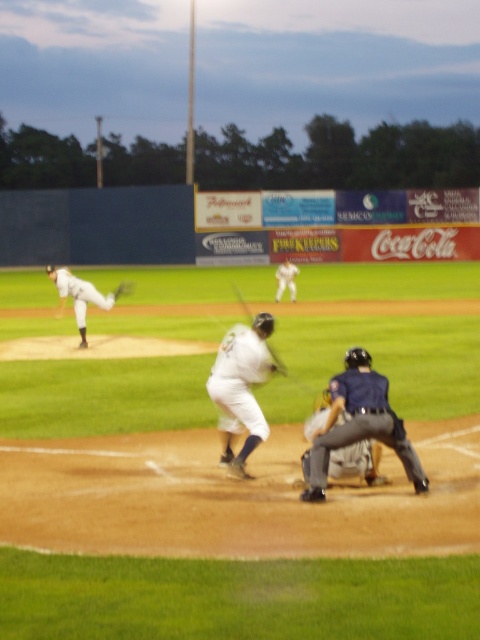
Is gray fabric catcher at center thinner than dark brown leather glove at center?

Indeed, gray fabric catcher at center has a lesser width compared to dark brown leather glove at center.

Is gray fabric catcher at center positioned in front of dark brown leather glove at center?

Yes, gray fabric catcher at center is in front of dark brown leather glove at center.

Is point (310, 454) closer to viewer compared to point (120, 291)?

Yes, it is.

Where is `gray fabric catcher at center`? Image resolution: width=480 pixels, height=640 pixels. gray fabric catcher at center is located at coordinates (357, 461).

Can you confirm if white uniform at center is positioned below wooden baseball bat at center?

No, white uniform at center is not below wooden baseball bat at center.

Does white uniform at center have a greater width compared to wooden baseball bat at center?

No, white uniform at center is not wider than wooden baseball bat at center.

The image size is (480, 640). What are the coordinates of `white uniform at center` in the screenshot? It's located at (286, 280).

Can you confirm if white matte baseball pitcher at left is positioned to the right of white uniform at center?

In fact, white matte baseball pitcher at left is to the left of white uniform at center.

This screenshot has height=640, width=480. Find the location of `white matte baseball pitcher at left`. white matte baseball pitcher at left is located at coordinates (82, 296).

Between point (87, 284) and point (291, 298), which one is positioned in front?

Positioned in front is point (87, 284).

Find the location of a particular element. This screenshot has width=480, height=640. white matte baseball pitcher at left is located at coordinates [82, 296].